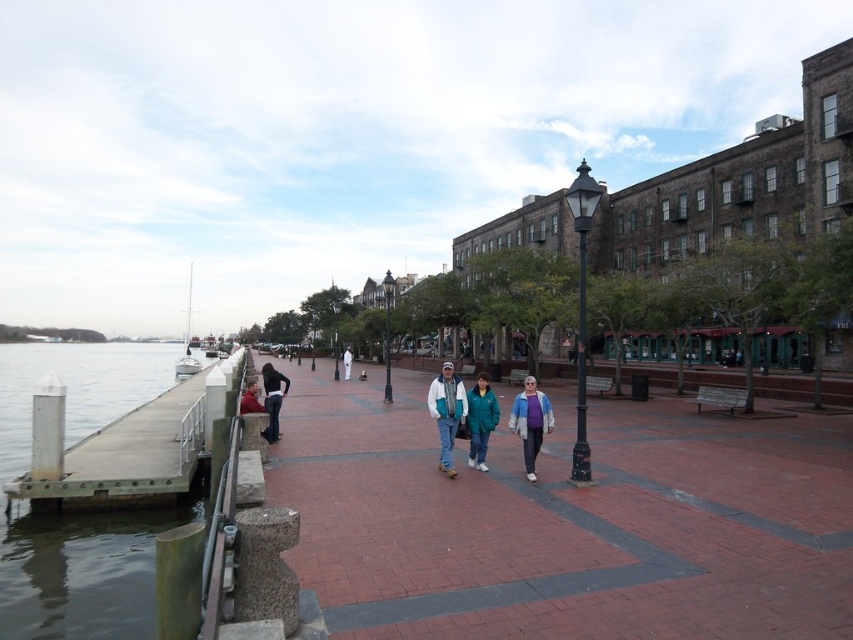
What do you see at coordinates (582, 308) in the screenshot? I see `black metal lamp post at center-right` at bounding box center [582, 308].

Which is more to the left, black metal lamp post at center-right or blue denim jacket at center?

blue denim jacket at center is more to the left.

Describe the element at coordinates (582, 308) in the screenshot. This screenshot has height=640, width=853. I see `black metal lamp post at center-right` at that location.

Find the location of a particular element. This screenshot has width=853, height=640. black metal lamp post at center-right is located at coordinates (582, 308).

Does black metal lamp post at center lie in front of white cotton jacket at center?

No, it is behind white cotton jacket at center.

Does black metal lamp post at center have a lesser width compared to white cotton jacket at center?

No, black metal lamp post at center is not thinner than white cotton jacket at center.

Where is `black metal lamp post at center`? black metal lamp post at center is located at coordinates (335, 337).

Locate an element on the screen. black metal lamp post at center is located at coordinates (335, 337).

Measure the distance between point (396, 428) and camera.

The distance of point (396, 428) from camera is 17.12 meters.

Who is positioned more to the right, brick pavement at center or blue denim jacket at center?

Positioned to the right is brick pavement at center.

Locate an element on the screen. The height and width of the screenshot is (640, 853). brick pavement at center is located at coordinates (566, 522).